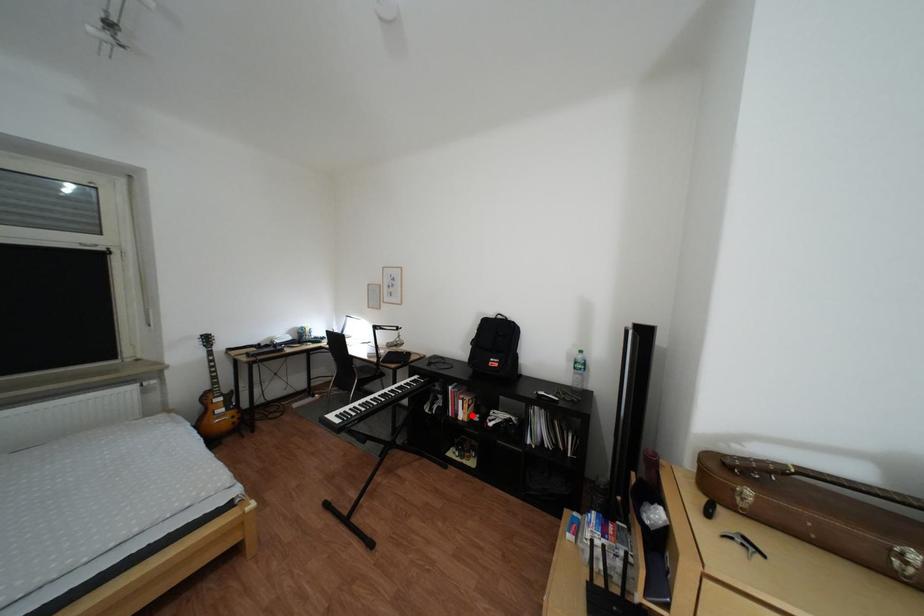
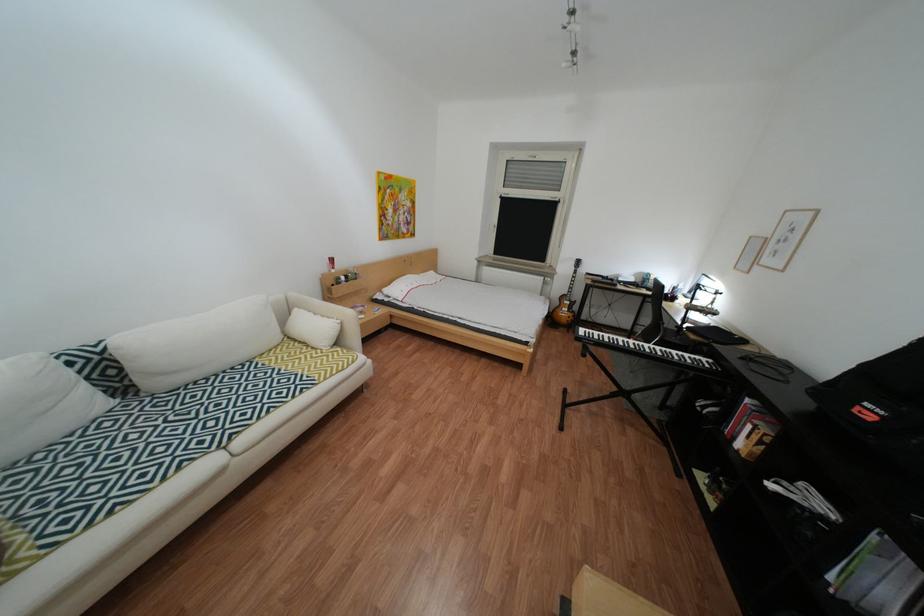
Where in the second image is the point corresponding to the highlighted location from the first image?

(749, 439)